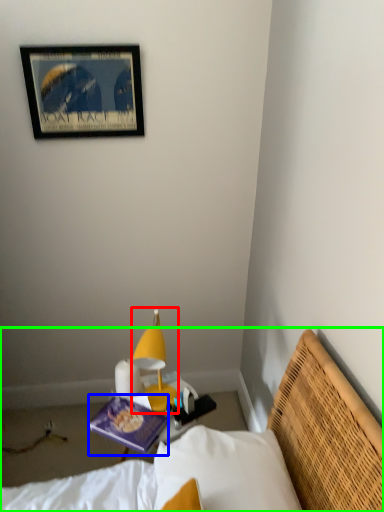
Question: Which is farther away from lamp (highlighted by a red box)? book (highlighted by a blue box) or bed (highlighted by a green box)?

Choices:
 (A) book
 (B) bed

Answer: (B)